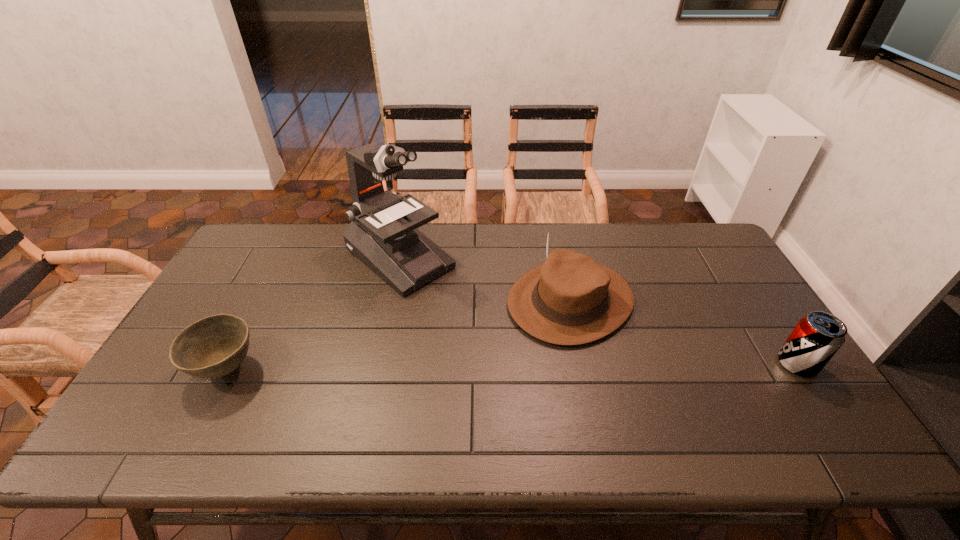
Find the location of `vacant space on the desktop that is between the bowl and the rightmost object and is positioned on the feather side of the second tallest object`. vacant space on the desktop that is between the bowl and the rightmost object and is positioned on the feather side of the second tallest object is located at coordinates (465, 367).

At what (x,y) coordinates should I click in order to perform the action: click on vacant space on the desktop that is between the leftmost object and the soda can and is positioned through the eyepieces of the tallest object. Please return your answer as a coordinate pair (x, y). Image resolution: width=960 pixels, height=540 pixels. Looking at the image, I should click on (537, 366).